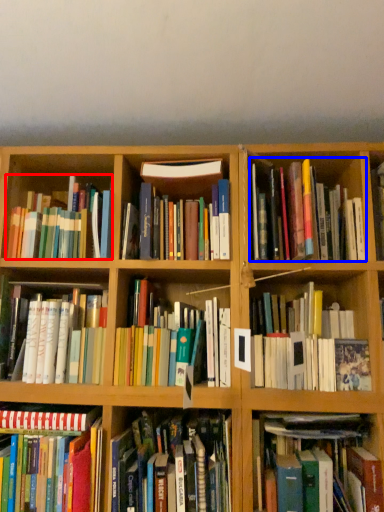
Question: Among these objects, which one is nearest to the camera, book (highlighted by a red box) or book (highlighted by a blue box)?

Choices:
 (A) book
 (B) book

Answer: (B)